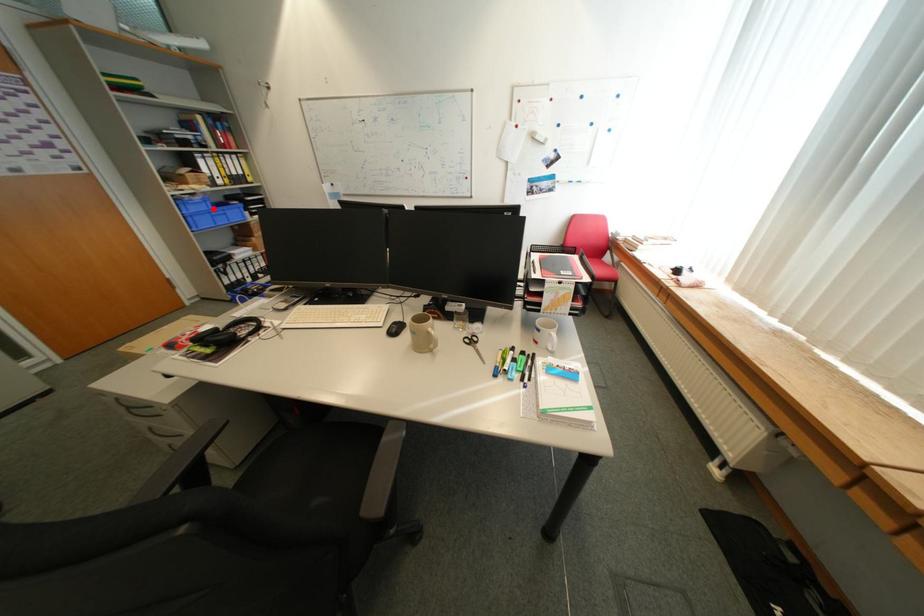
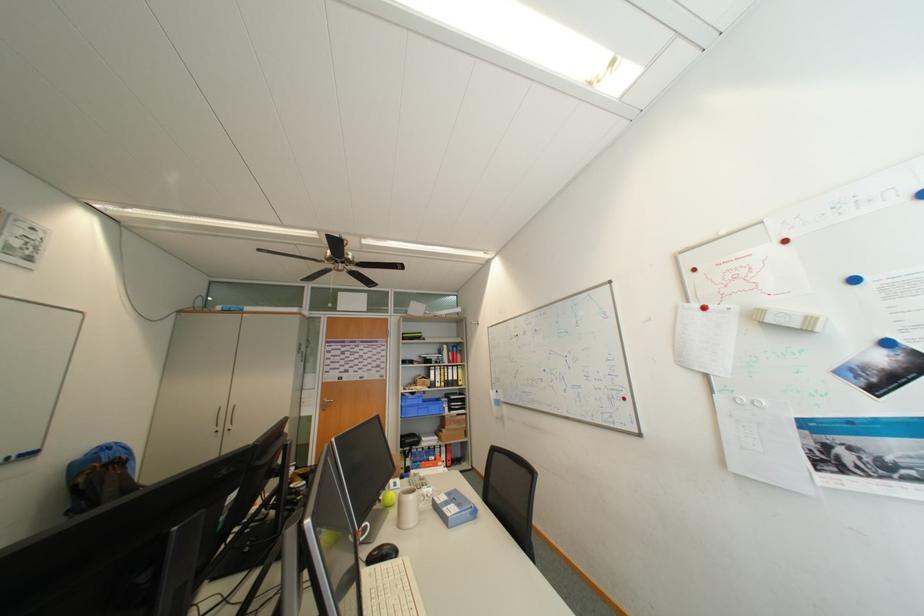
Question: I am providing you with two images of the same scene from different viewpoints. A red point is shown in image1. For the corresponding object point in image2, is it positioned nearer or farther from the camera?

Choices:
 (A) Nearer
 (B) Farther

Answer: (B)